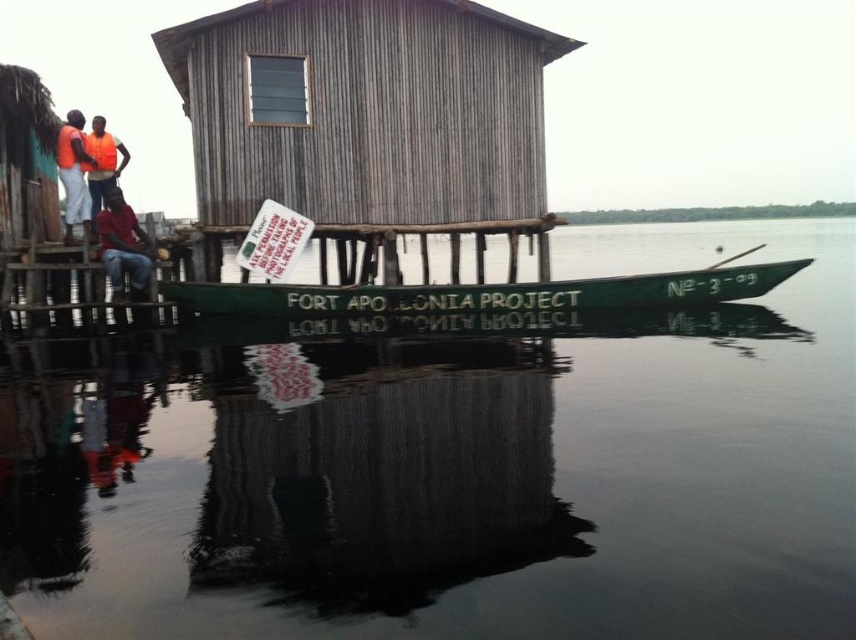
You are a visitor standing on the wooden platform near the orange life vest at left. You want to read the text on the white paper sign at center. Can you reach the sign without moving your feet?

The white paper sign at center is 3.18 meters away from the orange life vest at left. Since the distance is more than an average person can reach without moving, you cannot reach the sign without moving your feet.

You are a visitor approaching the wooden structure on stilts. You see a white paper sign at center and an orange life vest at left. Which object is shorter?

The white paper sign at center is not as tall as the orange life vest at left, so the white paper sign at center is shorter.